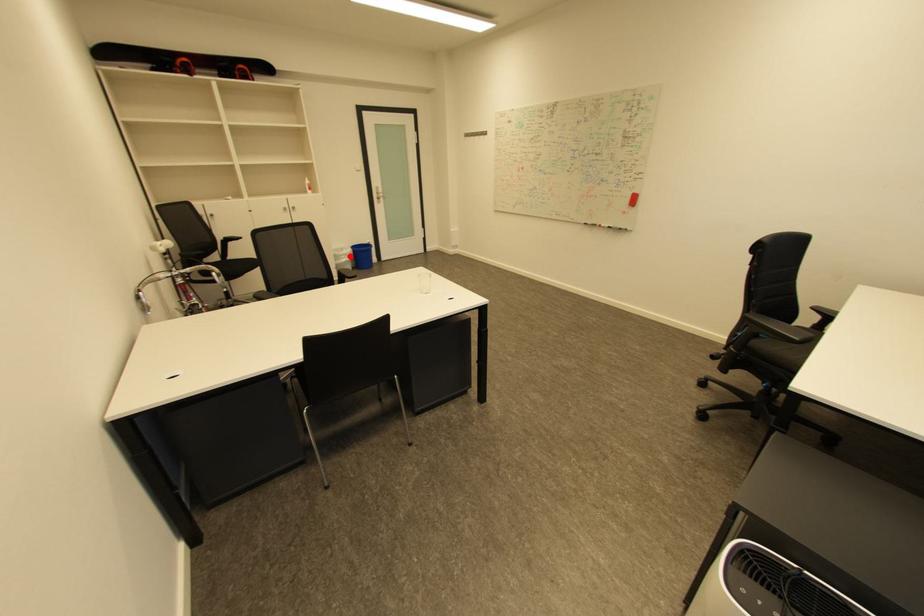
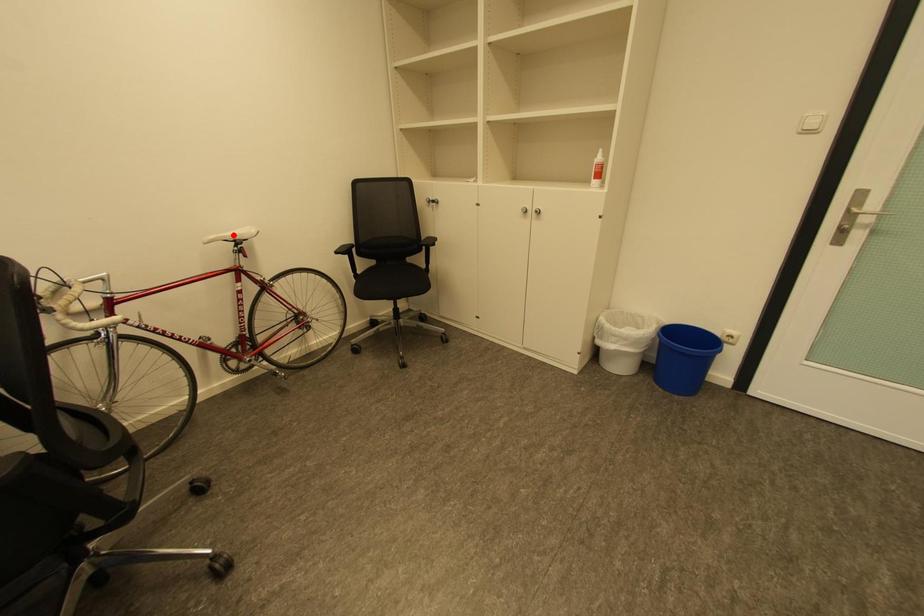
I am providing you with two images of the same scene from different viewpoints. A red point is marked on the first image and another point is marked on the second image. Do the highlighted points in image1 and image2 indicate the same real-world spot?

No